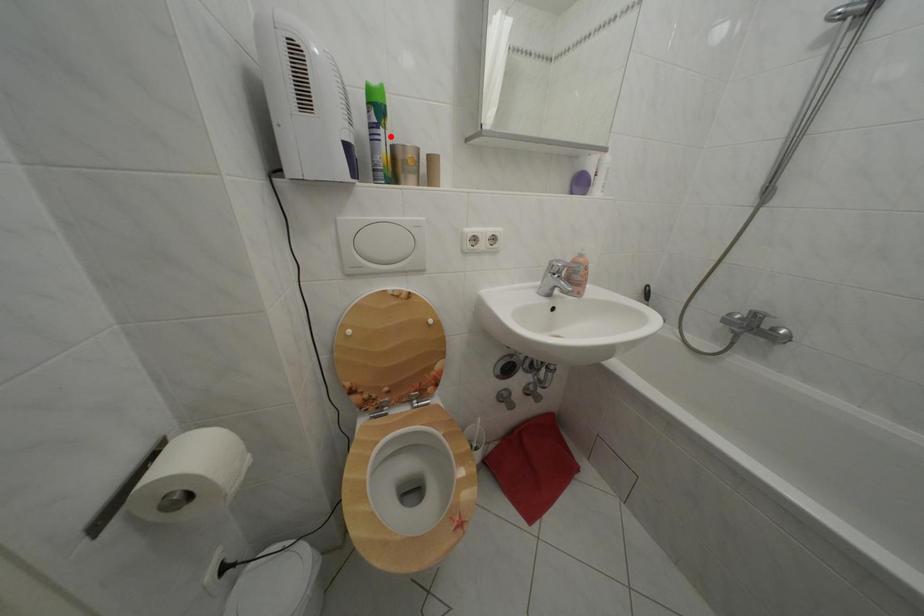
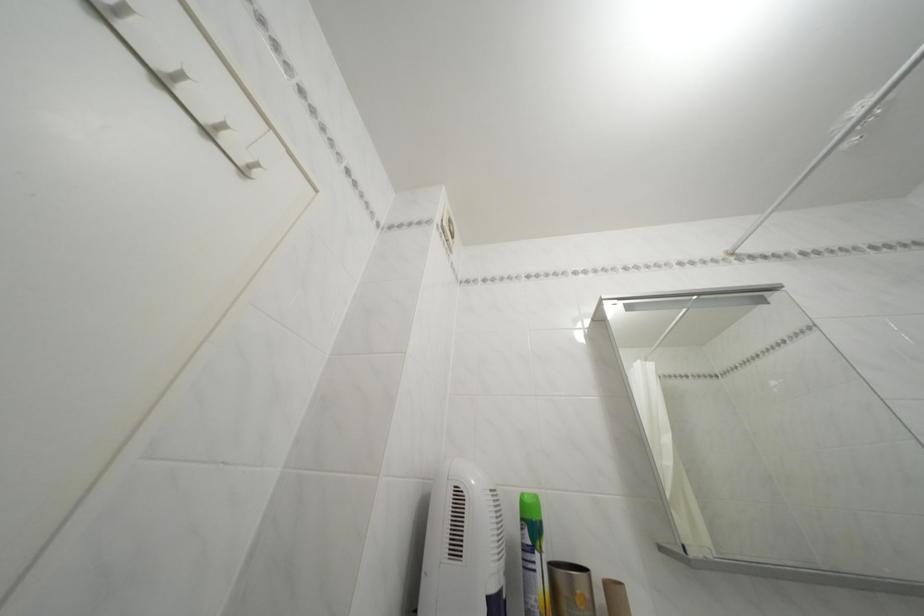
The point at the highlighted location is marked in the first image. Where is the corresponding point in the second image?

(545, 562)